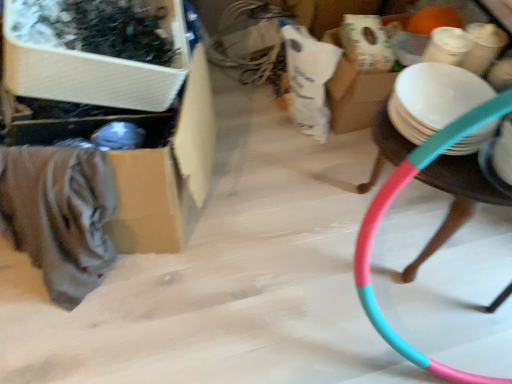
I want to click on wooden storage box at upper left, acting as the first storage box starting from the front, so click(88, 61).

The width and height of the screenshot is (512, 384). Identify the location of wooden storage box at upper left, the second storage box in the back-to-front sequence. (88, 61).

The width and height of the screenshot is (512, 384). I want to click on storage box that is under the white matte plate at right (from a real-world perspective), so click(151, 165).

From a real-world perspective, is white matte plate at right physically below cardboard box at left, the first storage box in the back-to-front sequence?

No, from a real-world perspective, white matte plate at right is not below cardboard box at left, the first storage box in the back-to-front sequence.

Which object is positioned more to the right, white matte plate at right or cardboard box at left, the first storage box in the back-to-front sequence?

white matte plate at right.

Considering the positions of point (397, 92) and point (70, 128), is point (397, 92) closer or farther from the camera than point (70, 128)?

Point (397, 92) appears to be farther away from the viewer than point (70, 128).

Is white matte plate at right positioned with its back to wooden storage box at upper left, the second storage box in the back-to-front sequence?

No, wooden storage box at upper left, the second storage box in the back-to-front sequence, is not at the back of white matte plate at right.

Choose the correct answer: Is white matte plate at right inside wooden storage box at upper left, the second storage box in the back-to-front sequence, or outside it?

white matte plate at right is not enclosed by wooden storage box at upper left, the second storage box in the back-to-front sequence.

Is white matte plate at right with wooden storage box at upper left, the second storage box in the back-to-front sequence?

No, white matte plate at right is not beside wooden storage box at upper left, the second storage box in the back-to-front sequence.

Find the location of a particular element. The width and height of the screenshot is (512, 384). the 1st storage box located above the pink plastic hoop at right (from a real-world perspective) is located at coordinates (151, 165).

What's the angular difference between pink plastic hoop at right and cardboard box at left, which appears as the second storage box when viewed from the front,'s facing directions?

The facing directions of pink plastic hoop at right and cardboard box at left, which appears as the second storage box when viewed from the front, are 14.6 degrees apart.

From the image's perspective, is pink plastic hoop at right on cardboard box at left, the first storage box in the back-to-front sequence?

Actually, pink plastic hoop at right appears below cardboard box at left, the first storage box in the back-to-front sequence, in the image.

Considering the relative sizes of pink plastic hoop at right and cardboard box at left, the first storage box in the back-to-front sequence, in the image provided, is pink plastic hoop at right wider than cardboard box at left, the first storage box in the back-to-front sequence,?

No, pink plastic hoop at right is not wider than cardboard box at left, the first storage box in the back-to-front sequence.

Considering the sizes of white matte plate at right and pink plastic hoop at right in the image, is white matte plate at right wider or thinner than pink plastic hoop at right?

white matte plate at right is thinner than pink plastic hoop at right.

From the image's perspective, does white matte plate at right appear higher than pink plastic hoop at right?

Yes, from the image's perspective, white matte plate at right is on top of pink plastic hoop at right.

Do you think white matte plate at right is within pink plastic hoop at right, or outside of it?

white matte plate at right is not enclosed by pink plastic hoop at right.

Does point (437, 121) lie behind point (368, 249)?

That is True.

Is white matte plate at right at the back of pink plastic hoop at right?

No, pink plastic hoop at right is not facing away from white matte plate at right.

Between pink plastic hoop at right and white matte plate at right, which one has less height?

With less height is white matte plate at right.

Considering the positions of point (394, 135) and point (466, 141), is point (394, 135) closer or farther from the camera than point (466, 141)?

Point (394, 135) is farther from the camera than point (466, 141).

Consider the image. From the image's perspective, who appears lower, pink plastic hoop at right or white matte plate at right?

pink plastic hoop at right is shown below in the image.

From a real-world perspective, is cardboard box at left, which appears as the second storage box when viewed from the front, located higher than wooden storage box at upper left, acting as the first storage box starting from the front?

Actually, cardboard box at left, which appears as the second storage box when viewed from the front, is physically below wooden storage box at upper left, acting as the first storage box starting from the front, in the real world.

Are cardboard box at left, the first storage box in the back-to-front sequence, and wooden storage box at upper left, the second storage box in the back-to-front sequence, beside each other?

cardboard box at left, the first storage box in the back-to-front sequence, and wooden storage box at upper left, the second storage box in the back-to-front sequence, are not in contact.

Consider the image. From the image's perspective, does cardboard box at left, the first storage box in the back-to-front sequence, appear higher than wooden storage box at upper left, the second storage box in the back-to-front sequence?

Incorrect, from the image's perspective, cardboard box at left, the first storage box in the back-to-front sequence, is lower than wooden storage box at upper left, the second storage box in the back-to-front sequence.

From a real-world perspective, is wooden storage box at upper left, the second storage box in the back-to-front sequence, physically located above or below cardboard box at left, which appears as the second storage box when viewed from the front?

wooden storage box at upper left, the second storage box in the back-to-front sequence, is situated higher than cardboard box at left, which appears as the second storage box when viewed from the front, in the real world.

From the image's perspective, which one is positioned higher, wooden storage box at upper left, acting as the first storage box starting from the front, or cardboard box at left, which appears as the second storage box when viewed from the front?

wooden storage box at upper left, acting as the first storage box starting from the front, appears higher in the image.

Is wooden storage box at upper left, acting as the first storage box starting from the front, positioned with its back to cardboard box at left, the first storage box in the back-to-front sequence?

wooden storage box at upper left, acting as the first storage box starting from the front, does not have its back to cardboard box at left, the first storage box in the back-to-front sequence.

Can you tell me how much wooden storage box at upper left, the second storage box in the back-to-front sequence, and cardboard box at left, which appears as the second storage box when viewed from the front, differ in facing direction?

11.9 degrees.

Locate an element on the screen. This screenshot has width=512, height=384. plate on the right of cardboard box at left, the first storage box in the back-to-front sequence is located at coordinates (433, 98).

There is a white matte plate at right. Find the location of `storage box above it (from a real-world perspective)`. storage box above it (from a real-world perspective) is located at coordinates (88, 61).

Which object lies further to the anchor point pink plastic hoop at right, cardboard box at left, which appears as the second storage box when viewed from the front, or white matte plate at right?

The object further to pink plastic hoop at right is cardboard box at left, which appears as the second storage box when viewed from the front.

When comparing their distances from white matte plate at right, does wooden storage box at upper left, the second storage box in the back-to-front sequence, or pink plastic hoop at right seem further?

wooden storage box at upper left, the second storage box in the back-to-front sequence, is further to white matte plate at right.

Based on their spatial positions, is wooden storage box at upper left, the second storage box in the back-to-front sequence, or cardboard box at left, the first storage box in the back-to-front sequence, closer to white matte plate at right?

cardboard box at left, the first storage box in the back-to-front sequence, is closer to white matte plate at right.

From the image, which object appears to be nearer to white matte plate at right, pink plastic hoop at right or cardboard box at left, which appears as the second storage box when viewed from the front?

The object closer to white matte plate at right is pink plastic hoop at right.

When comparing their distances from wooden storage box at upper left, the second storage box in the back-to-front sequence, does pink plastic hoop at right or cardboard box at left, which appears as the second storage box when viewed from the front, seem further?

The object further to wooden storage box at upper left, the second storage box in the back-to-front sequence, is pink plastic hoop at right.

Looking at the image, which one is located further to cardboard box at left, the first storage box in the back-to-front sequence, pink plastic hoop at right or white matte plate at right?

white matte plate at right is positioned further to the anchor cardboard box at left, the first storage box in the back-to-front sequence.

Based on their spatial positions, is cardboard box at left, the first storage box in the back-to-front sequence, or wooden storage box at upper left, acting as the first storage box starting from the front, closer to pink plastic hoop at right?

cardboard box at left, the first storage box in the back-to-front sequence.

Looking at the image, which one is located further to cardboard box at left, the first storage box in the back-to-front sequence, white matte plate at right or pink plastic hoop at right?

The object further to cardboard box at left, the first storage box in the back-to-front sequence, is white matte plate at right.

Find the location of a particular element. Image resolution: width=512 pixels, height=384 pixels. plate situated between cardboard box at left, the first storage box in the back-to-front sequence, and pink plastic hoop at right from left to right is located at coordinates (433, 98).

Find the location of `plate between wooden storage box at upper left, the second storage box in the back-to-front sequence, and pink plastic hoop at right`. plate between wooden storage box at upper left, the second storage box in the back-to-front sequence, and pink plastic hoop at right is located at coordinates (433, 98).

Where is `storage box located between cardboard box at left, which appears as the second storage box when viewed from the front, and pink plastic hoop at right in the left-right direction`? The height and width of the screenshot is (384, 512). storage box located between cardboard box at left, which appears as the second storage box when viewed from the front, and pink plastic hoop at right in the left-right direction is located at coordinates (88, 61).

I want to click on storage box between cardboard box at left, the first storage box in the back-to-front sequence, and white matte plate at right, so click(x=88, y=61).